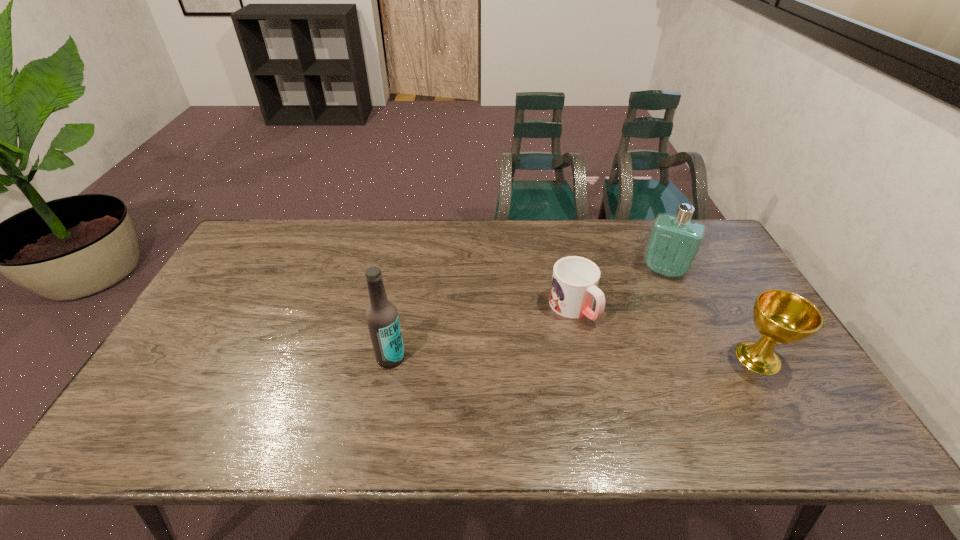
Identify the location of free space that satisfies the following two spatial constraints: 1. on the front side of the perfume; 2. on the right side of the chalice. (705, 357).

The height and width of the screenshot is (540, 960). I want to click on free location that satisfies the following two spatial constraints: 1. on the side of the third tallest object with the label; 2. on the right side of the leftmost object, so click(391, 357).